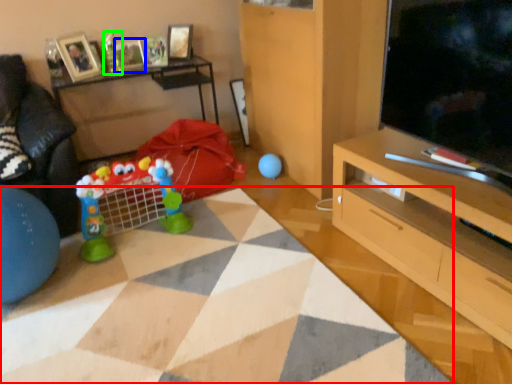
Question: Based on their relative distances, which object is nearer to plain (highlighted by a red box)? Choose from picture frame (highlighted by a blue box) and toy (highlighted by a green box).

Choices:
 (A) picture frame
 (B) toy

Answer: (B)